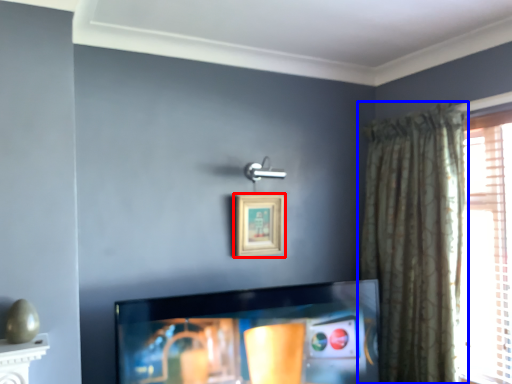
Question: Which point is further to the camera, picture frame (highlighted by a red box) or curtain (highlighted by a blue box)?

Choices:
 (A) picture frame
 (B) curtain

Answer: (A)